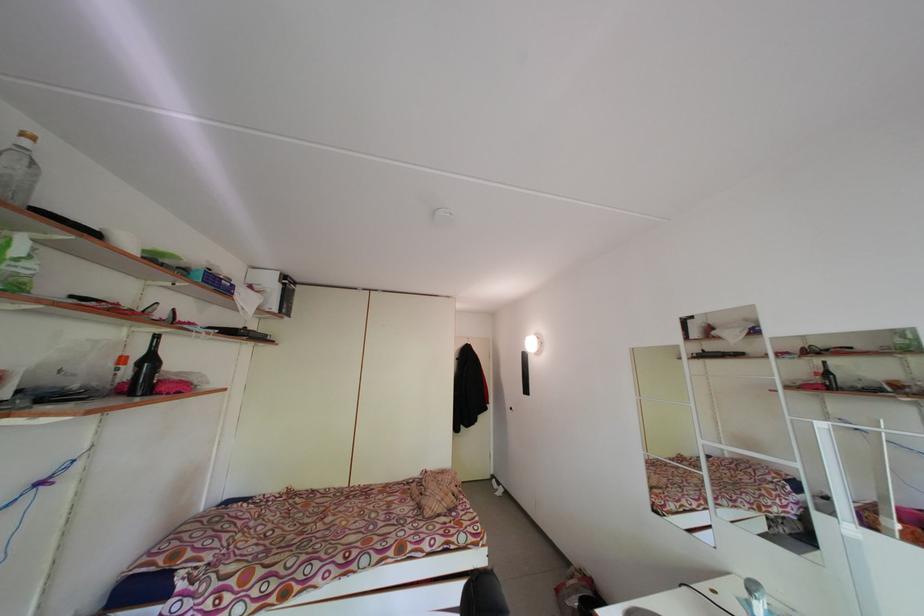
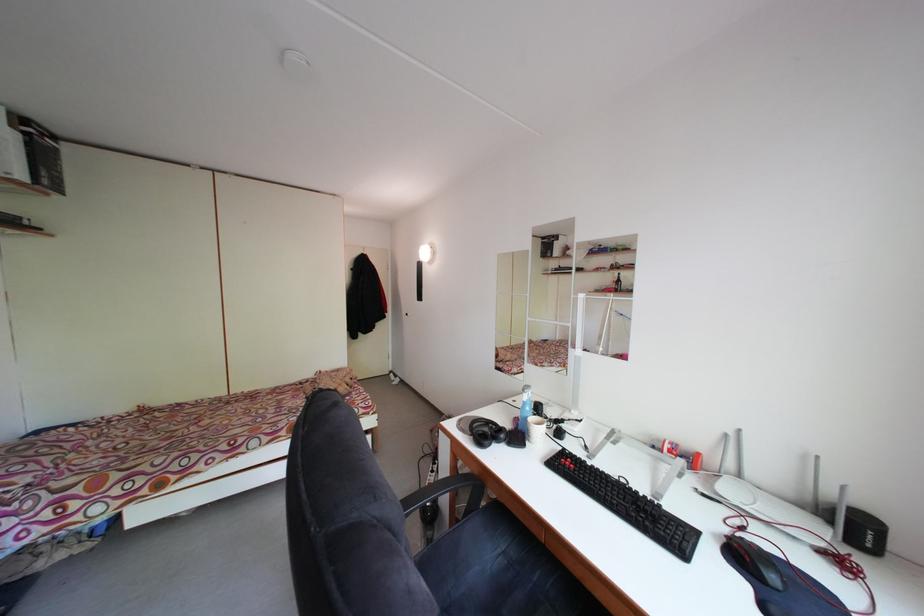
Locate, in the second image, the point that corresponds to (808,376) in the first image.

(614, 285)